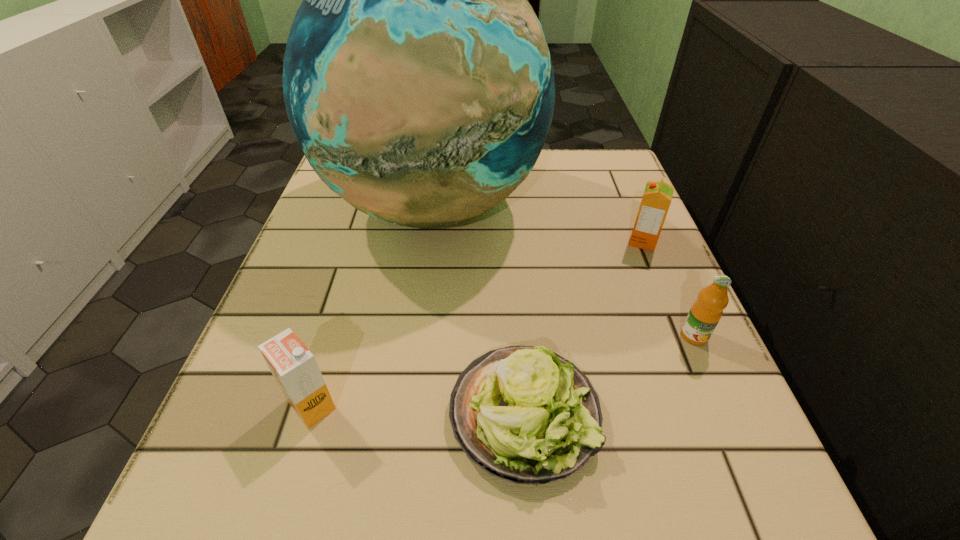
Identify which object is the second nearest to the farthest orange juice. Please provide its 2D coordinates. Your answer should be formatted as a tuple, i.e. [(x, y)], where the tuple contains the x and y coordinates of a point satisfying the conditions above.

[(705, 313)]

Where is `the second closest object to the second farthest orange juice`? The height and width of the screenshot is (540, 960). the second closest object to the second farthest orange juice is located at coordinates (657, 197).

Select which orange juice is the third closest to the tallest object. Please provide its 2D coordinates. Your answer should be formatted as a tuple, i.e. [(x, y)], where the tuple contains the x and y coordinates of a point satisfying the conditions above.

[(705, 313)]

Identify the location of orange juice identified as the second closest to the globe. (294, 367).

Find the location of `vacant space that satisfies the following two spatial constraints: 1. on the back side of the tallest object; 2. on the left side of the nearest orange juice`. vacant space that satisfies the following two spatial constraints: 1. on the back side of the tallest object; 2. on the left side of the nearest orange juice is located at coordinates (372, 206).

Locate an element on the screen. This screenshot has width=960, height=540. free location that satisfies the following two spatial constraints: 1. on the back side of the tallest object; 2. on the right side of the leftmost orange juice is located at coordinates (372, 206).